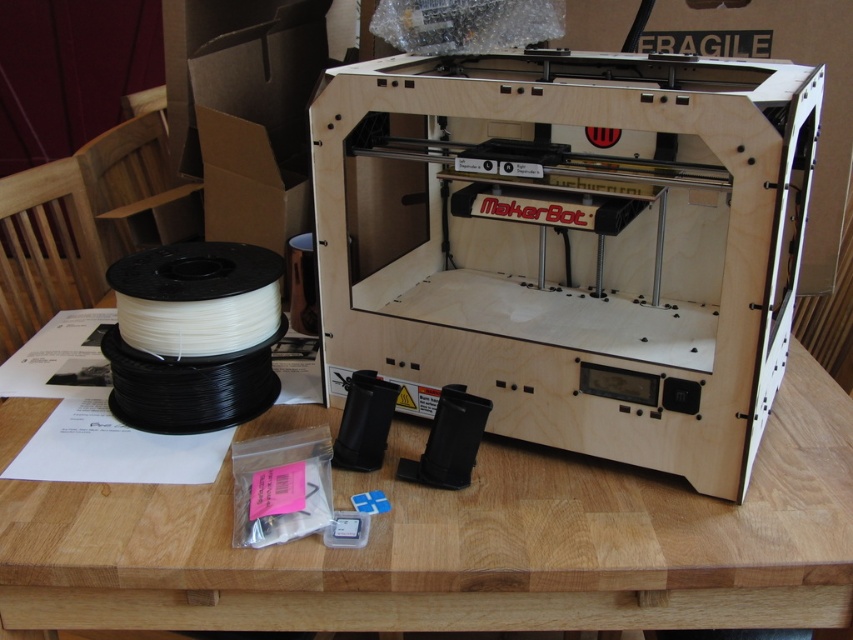
Question: Among these points, which one is nearest to the camera?

Choices:
 (A) (270, 269)
 (B) (685, 531)

Answer: (B)

Question: Can you confirm if wooden table at center is positioned to the right of white matte filament at lower left?

Choices:
 (A) no
 (B) yes

Answer: (B)

Question: Among these objects, which one is nearest to the camera?

Choices:
 (A) white matte filament at lower left
 (B) wooden table at center

Answer: (B)

Question: Can you confirm if wooden table at center is smaller than white matte filament at lower left?

Choices:
 (A) no
 (B) yes

Answer: (A)

Question: Is wooden table at center closer to the viewer compared to white matte filament at lower left?

Choices:
 (A) no
 (B) yes

Answer: (B)

Question: Which point is closer to the camera?

Choices:
 (A) (194, 352)
 (B) (802, 381)

Answer: (A)